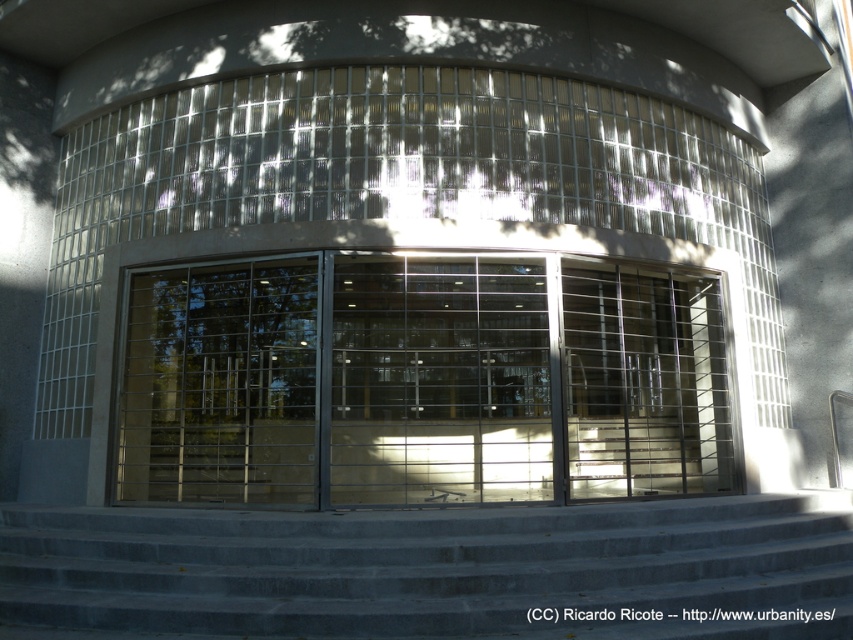
Question: Estimate the real-world distances between objects in this image. Which object is closer to the gray concrete stairs at lower center?

Choices:
 (A) clear glass door at center
 (B) transparent glass door at center

Answer: (A)

Question: Is clear glass door at center positioned before gray concrete stairs at lower center?

Choices:
 (A) yes
 (B) no

Answer: (B)

Question: In this image, where is clear glass door at center located relative to gray concrete stairs at lower center?

Choices:
 (A) right
 (B) left

Answer: (A)

Question: Which object is the closest to the transparent glass door at center?

Choices:
 (A) gray concrete stairs at lower center
 (B) clear glass door at center

Answer: (B)

Question: Estimate the real-world distances between objects in this image. Which object is farther from the transparent glass door at center?

Choices:
 (A) gray concrete stairs at lower center
 (B) clear glass door at center

Answer: (A)

Question: Does gray concrete stairs at lower center have a smaller size compared to transparent glass door at center?

Choices:
 (A) yes
 (B) no

Answer: (A)